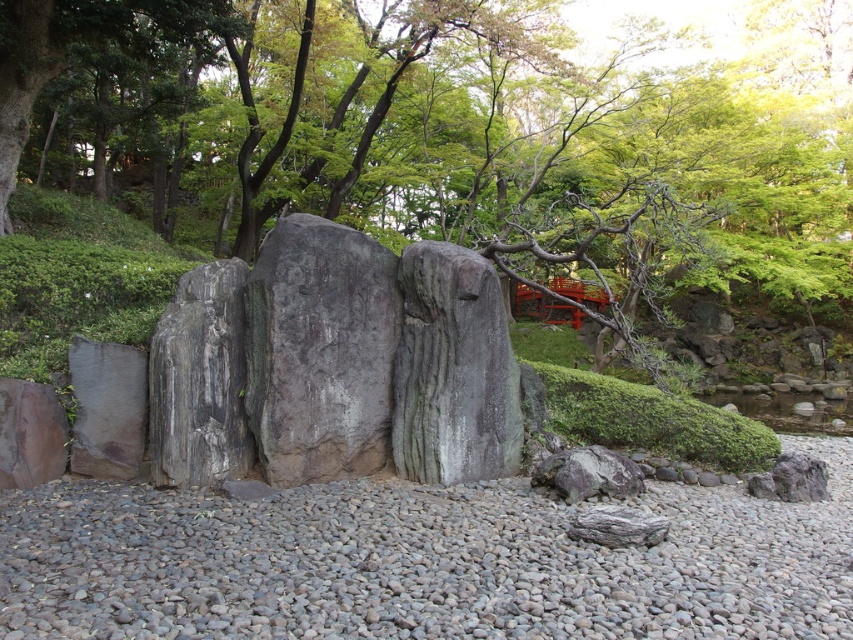
Does point (676, 172) come closer to viewer compared to point (386, 316)?

No, (676, 172) is behind (386, 316).

Does smooth bark tree at center come in front of gray rough rock at center?

No, it is behind gray rough rock at center.

Measure the distance between point (x=659, y=148) and camera.

15.25 meters

The image size is (853, 640). What are the coordinates of `smooth bark tree at center` in the screenshot? It's located at (451, 132).

Can you confirm if gray gravel at center is positioned above gray rough rock at center?

Incorrect, gray gravel at center is not positioned above gray rough rock at center.

Is gray gravel at center shorter than gray rough rock at center?

Correct, gray gravel at center is not as tall as gray rough rock at center.

At what (x,y) coordinates should I click in order to perform the action: click on gray gravel at center. Please return your answer as a coordinate pair (x, y). Looking at the image, I should click on (421, 563).

Does smooth bark tree at center have a larger size compared to gray gravel at center?

Yes.

Image resolution: width=853 pixels, height=640 pixels. Find the location of `smooth bark tree at center`. smooth bark tree at center is located at coordinates (451, 132).